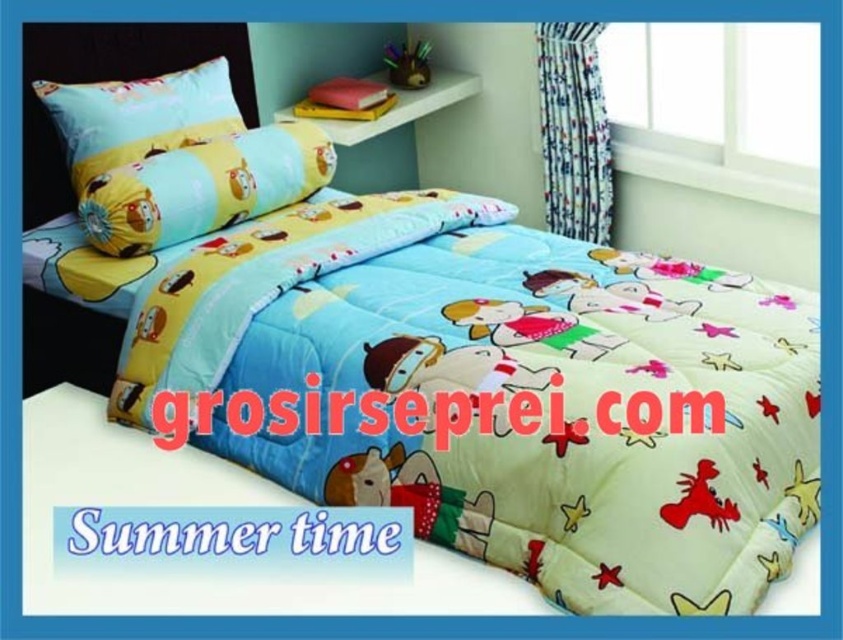
Is point (216, 152) closer to camera compared to point (78, 179)?

Yes, point (216, 152) is closer to viewer.

I want to click on yellow fabric pillow at upper left, so click(x=203, y=188).